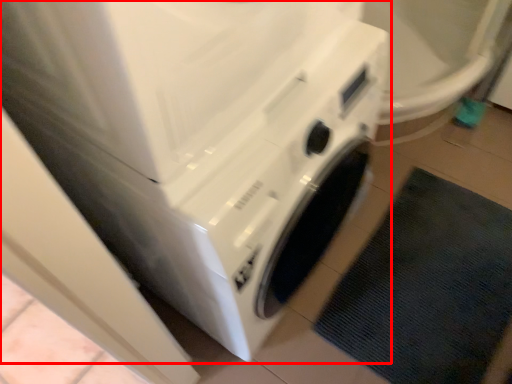
Question: In this image, where is washing machine (annotated by the red box) located relative to bath mat?

Choices:
 (A) left
 (B) right

Answer: (A)